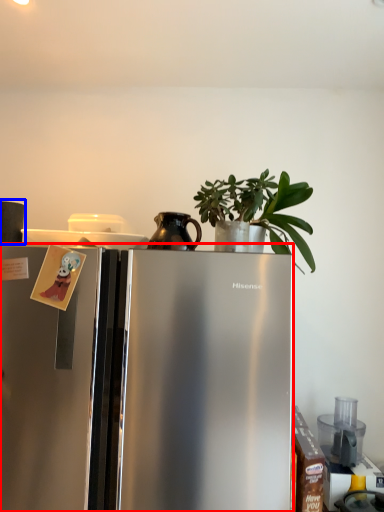
Question: Which of the following is the farthest to the observer, refrigerator (highlighted by a red box) or appliance (highlighted by a blue box)?

Choices:
 (A) refrigerator
 (B) appliance

Answer: (B)